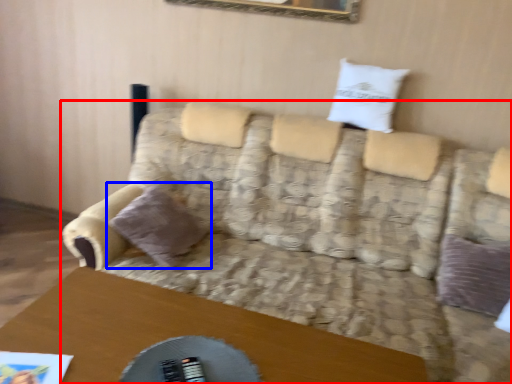
Question: Which of the following is the farthest to the observer, studio couch (highlighted by a red box) or pillow (highlighted by a blue box)?

Choices:
 (A) studio couch
 (B) pillow

Answer: (B)